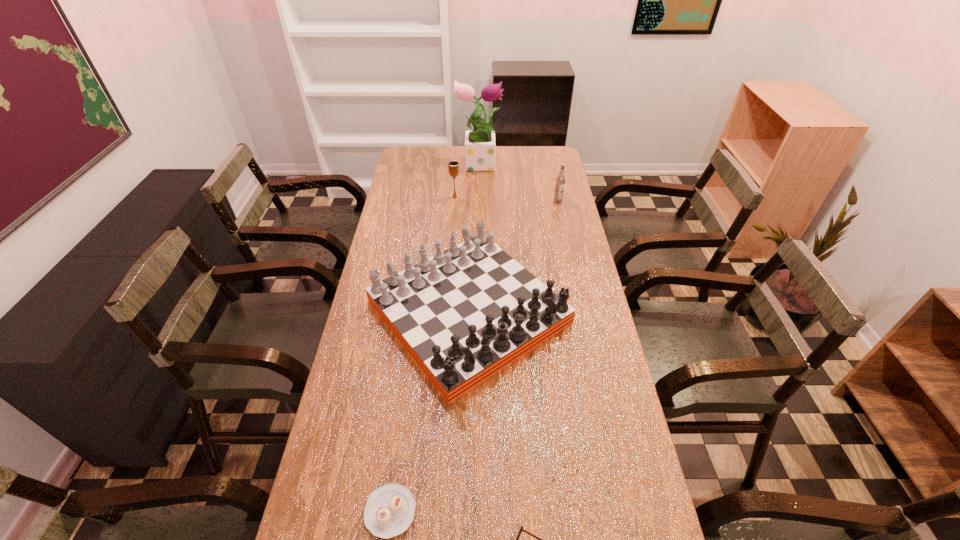
This screenshot has width=960, height=540. In order to click on flower arrangement in this screenshot , I will do `click(480, 142)`.

Identify the location of the tallest object. This screenshot has height=540, width=960. (480, 142).

What are the coordinates of `vodka` in the screenshot? It's located at (560, 179).

Where is `chalice`? This screenshot has width=960, height=540. chalice is located at coordinates (453, 166).

This screenshot has width=960, height=540. I want to click on gameboard, so click(464, 314).

Locate an element on the screen. free space located 0.170m on the front-facing side of the farthest object is located at coordinates (538, 162).

Image resolution: width=960 pixels, height=540 pixels. In order to click on vacant point located 0.110m on the label of the vodka in this screenshot , I will do `click(562, 220)`.

Identify the location of vacant space situated on the front of the chalice. This screenshot has height=540, width=960. (452, 240).

At what (x,y) coordinates should I click in order to perform the action: click on vacant space located on the right of the gameboard. Please return your answer as a coordinate pair (x, y). The width and height of the screenshot is (960, 540). Looking at the image, I should click on pos(590,312).

Locate an element on the screen. The image size is (960, 540). object at the far edge is located at coordinates (480, 142).